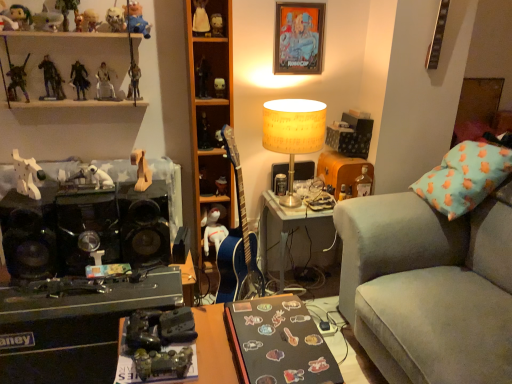
Locate an element on the screen. This screenshot has width=512, height=384. matte plastic toy at upper center, which ranks as the fifth toy in top-to-bottom order is located at coordinates (217, 25).

Measure the distance between velvet grey couch at right and camera.

A distance of 4.33 feet exists between velvet grey couch at right and camera.

Locate an element on the screen. Image resolution: width=512 pixels, height=384 pixels. metallic green toy at center, the eighteenth toy positioned from the top is located at coordinates (162, 363).

In order to click on blue soft pillow at right in this screenshot , I will do `click(464, 177)`.

In order to face blue soft pillow at right, should I rotate leftwards or rightwards?

To face it directly, rotate right by 31.695 degrees.

You are a GUI agent. You are given a task and a screenshot of the screen. Output one action in this format:
    pyautogui.click(x=<x>, y=<y>)
    Task: Click on the metallic action figure at left, which is counted as the 14th toy, starting from the top
    
    Given the screenshot: What is the action you would take?
    pyautogui.click(x=17, y=80)

From the picture: Considering the sizes of objects matte black action figures at upper left, placed as the 9th toy when sorted from bottom to top, and wooden figurine at upper left, which is counted as the second toy, starting from the top, in the image provided, who is smaller, matte black action figures at upper left, placed as the 9th toy when sorted from bottom to top, or wooden figurine at upper left, which is counted as the second toy, starting from the top,?

With smaller size is matte black action figures at upper left, placed as the 9th toy when sorted from bottom to top.

Is point (46, 63) closer or farther from the camera than point (70, 7)?

Clearly, point (46, 63) is more distant from the camera than point (70, 7).

Considering the relative positions of matte black action figures at upper left, placed as the 9th toy when sorted from bottom to top, and wooden figurine at upper left, which is counted as the second toy, starting from the top, in the image provided, is matte black action figures at upper left, placed as the 9th toy when sorted from bottom to top, to the left or to the right of wooden figurine at upper left, which is counted as the second toy, starting from the top,?

In the image, matte black action figures at upper left, placed as the 9th toy when sorted from bottom to top, appears on the left side of wooden figurine at upper left, which is counted as the second toy, starting from the top.

Is matte black action figures at upper left, placed as the 9th toy when sorted from bottom to top, situated inside wooden figurine at upper left, which is the 17th toy from bottom to top, or outside?

matte black action figures at upper left, placed as the 9th toy when sorted from bottom to top, is not inside wooden figurine at upper left, which is the 17th toy from bottom to top, it's outside.

From a real-world perspective, which object rests below the other?

white matte dog at center, the 17th toy positioned from the top, is physically lower.

How distant is matte black action figures at upper left, placed as the 9th toy when sorted from bottom to top, from white matte dog at center, acting as the 2th toy starting from the bottom?

matte black action figures at upper left, placed as the 9th toy when sorted from bottom to top, is 18.08 inches away from white matte dog at center, acting as the 2th toy starting from the bottom.

Is the surface of matte black action figures at upper left, placed as the 9th toy when sorted from bottom to top, in direct contact with white matte dog at center, the 17th toy positioned from the top?

matte black action figures at upper left, placed as the 9th toy when sorted from bottom to top, and white matte dog at center, the 17th toy positioned from the top, are not in contact.

Which is in front, point (53, 62) or point (81, 178)?

The point (81, 178) is in front.

Considering the relative positions of matte black action figures at upper left, which is the 10th toy in top-to-bottom order, and dark matte figure at upper left, the twelfth toy when ordered from top to bottom, in the image provided, is matte black action figures at upper left, which is the 10th toy in top-to-bottom order, to the right of dark matte figure at upper left, the twelfth toy when ordered from top to bottom, from the viewer's perspective?

No.

From the image's perspective, between matte black action figures at upper left, which is the 10th toy in top-to-bottom order, and dark matte figure at upper left, the 7th toy ordered from the bottom, who is located below?

From the image's view, dark matte figure at upper left, the 7th toy ordered from the bottom, is below.

Does matte black action figures at upper left, which is the 10th toy in top-to-bottom order, have a greater height compared to dark matte figure at upper left, the 7th toy ordered from the bottom?

Yes.

Is matte black action figures at upper left, which is the 10th toy in top-to-bottom order, thinner than dark matte figure at upper left, the twelfth toy when ordered from top to bottom?

Indeed, matte black action figures at upper left, which is the 10th toy in top-to-bottom order, has a lesser width compared to dark matte figure at upper left, the twelfth toy when ordered from top to bottom.

Is matte plastic action figure at center, arranged as the 6th toy when ordered from the bottom, positioned far away from velvet grey couch at right?

Indeed, matte plastic action figure at center, arranged as the 6th toy when ordered from the bottom, is not near velvet grey couch at right.

Could you tell me if matte plastic action figure at center, arranged as the 6th toy when ordered from the bottom, is facing velvet grey couch at right?

No, matte plastic action figure at center, arranged as the 6th toy when ordered from the bottom, is not oriented towards velvet grey couch at right.

From the image's perspective, is matte plastic action figure at center, which is counted as the thirteenth toy, starting from the top, beneath velvet grey couch at right?

No, from the image's perspective, matte plastic action figure at center, which is counted as the thirteenth toy, starting from the top, is not below velvet grey couch at right.

Considering the relative positions of shiny plastic toy at upper left, the 15th toy when ordered from bottom to top, and black matte desk at lower center, the 1th desk from the right, in the image provided, is shiny plastic toy at upper left, the 15th toy when ordered from bottom to top, behind black matte desk at lower center, the 1th desk from the right,?

Yes.

Is point (119, 14) positioned before point (199, 344)?

No, it is not.

Is shiny plastic toy at upper left, which ranks as the fourth toy in top-to-bottom order, oriented away from black matte desk at lower center, the 1th desk from the right?

No, black matte desk at lower center, the 1th desk from the right, is not at the back of shiny plastic toy at upper left, which ranks as the fourth toy in top-to-bottom order.

From the image's perspective, starting from the shiny plastic toy at upper left, the 15th toy when ordered from bottom to top, which desk is the 1st one below? Please provide its 2D coordinates.

[(266, 343)]

Between metallic silver figure at upper left, which ranks as the 11th toy in top-to-bottom order, and matte black action figures at upper left, placed as the 9th toy when sorted from bottom to top, which one appears on the left side from the viewer's perspective?

matte black action figures at upper left, placed as the 9th toy when sorted from bottom to top.

Measure the distance from metallic silver figure at upper left, which ranks as the 11th toy in top-to-bottom order, to matte black action figures at upper left, placed as the 9th toy when sorted from bottom to top.

A distance of 7.61 inches exists between metallic silver figure at upper left, which ranks as the 11th toy in top-to-bottom order, and matte black action figures at upper left, placed as the 9th toy when sorted from bottom to top.

Consider the image. Can matte black action figures at upper left, which is the 10th toy in top-to-bottom order, be found inside metallic silver figure at upper left, which ranks as the 11th toy in top-to-bottom order?

Actually, matte black action figures at upper left, which is the 10th toy in top-to-bottom order, is outside metallic silver figure at upper left, which ranks as the 11th toy in top-to-bottom order.

From a real-world perspective, is metallic silver figure at upper left, which ranks as the 11th toy in top-to-bottom order, physically located above or below matte black action figures at upper left, which is the 10th toy in top-to-bottom order?

metallic silver figure at upper left, which ranks as the 11th toy in top-to-bottom order, is below matte black action figures at upper left, which is the 10th toy in top-to-bottom order.

Considering the relative sizes of wooden horse at center, arranged as the 4th toy when ordered from the bottom, and translucent glass bottle at right in the image provided, is wooden horse at center, arranged as the 4th toy when ordered from the bottom, thinner than translucent glass bottle at right?

Incorrect, the width of wooden horse at center, arranged as the 4th toy when ordered from the bottom, is not less than that of translucent glass bottle at right.

Is wooden horse at center, marked as the 15th toy in a top-to-bottom arrangement, inside or outside of translucent glass bottle at right?

wooden horse at center, marked as the 15th toy in a top-to-bottom arrangement, is spatially situated outside translucent glass bottle at right.

I want to click on the 15th toy in front when counting from the translucent glass bottle at right, so click(x=141, y=170).

Can you confirm if wooden horse at center, marked as the 15th toy in a top-to-bottom arrangement, is smaller than translucent glass bottle at right?

No.

Find the location of a particular element. the 6th toy in front when counting from the matte black action figures at upper left, placed as the 9th toy when sorted from bottom to top is located at coordinates 67,10.

From a real-world perspective, count 8th toys downward from the matte black action figures at upper left, which is the 10th toy in top-to-bottom order, and point to it. Please provide its 2D coordinates.

[(88, 178)]

In the scene shown: Which object lies further to the anchor point velvet grey couch at right, matte black figurine at upper left, the 12th toy in the bottom-to-top sequence, or yellow paper lampshade at upper right?

matte black figurine at upper left, the 12th toy in the bottom-to-top sequence, lies further to velvet grey couch at right than the other object.

Estimate the real-world distances between objects in this image. Which object is further from matte black figurine at center, which is the 11th toy from bottom to top, matte plastic action figure at center, which is counted as the thirteenth toy, starting from the top, or white matte dog at center, the 17th toy positioned from the top?

white matte dog at center, the 17th toy positioned from the top, is further to matte black figurine at center, which is the 11th toy from bottom to top.

Estimate the real-world distances between objects in this image. Which object is closer to matte plastic doll at upper center, arranged as the 1th toy when viewed from the top, white plastic action figures at upper left or metallic gold figure at upper center, placed as the 10th toy when sorted from bottom to top?

Based on the image, metallic gold figure at upper center, placed as the 10th toy when sorted from bottom to top, appears to be nearer to matte plastic doll at upper center, arranged as the 1th toy when viewed from the top.

From the image, which object appears to be nearer to matte black action figures at upper left, which is the 10th toy in top-to-bottom order, velvet grey couch at right or metallic green toy at center, the eighteenth toy positioned from the top?

Based on the image, metallic green toy at center, the eighteenth toy positioned from the top, appears to be nearer to matte black action figures at upper left, which is the 10th toy in top-to-bottom order.

Which object lies nearer to the anchor point white matte dog at center, acting as the 2th toy starting from the bottom, matte black figurine at center, which is the 11th toy from bottom to top, or blue fabric toy at upper left, placed as the 16th toy when sorted from bottom to top?

matte black figurine at center, which is the 11th toy from bottom to top.

Based on their spatial positions, is metallic green toy at center, the eighteenth toy positioned from the top, or wooden figurine at upper left, which is the 17th toy from bottom to top, closer to matte black figurine at center, the 8th toy from the top?

wooden figurine at upper left, which is the 17th toy from bottom to top, is closer to matte black figurine at center, the 8th toy from the top.

Estimate the real-world distances between objects in this image. Which object is further from matte black figurine at upper left, the 12th toy in the bottom-to-top sequence, metallic action figure at left, positioned as the 5th toy in bottom-to-top order, or dark matte figure at upper left, the 7th toy ordered from the bottom?

dark matte figure at upper left, the 7th toy ordered from the bottom.

Which object lies further to the anchor point woodenmaterial/textureshelf at center, yellow paper lampshade at upper right or velvet grey couch at right?

velvet grey couch at right is positioned further to the anchor woodenmaterial/textureshelf at center.

Locate an element on the screen. The image size is (512, 384). studio couch between wooden figurine at upper left, which is the 17th toy from bottom to top, and blue soft pillow at right is located at coordinates (428, 288).

At what (x,y) coordinates should I click in order to perform the action: click on picture frame situated between dark matte figure at upper left, the twelfth toy when ordered from top to bottom, and translucent glass bottle at right from left to right. Please return your answer as a coordinate pair (x, y). This screenshot has width=512, height=384. Looking at the image, I should click on (298, 38).

Locate an element on the screen. shelf located between matte black figurine at upper left, which is the 7th toy from top to bottom, and translucent glass bottle at right in the left-right direction is located at coordinates (210, 114).

The height and width of the screenshot is (384, 512). In order to click on cabinetry located between white matte wooden dog at left, the third toy from the bottom, and translucent glass bottle at right in the left-right direction in this screenshot , I will do point(58,34).